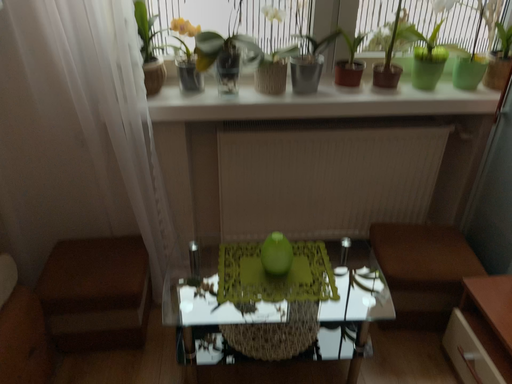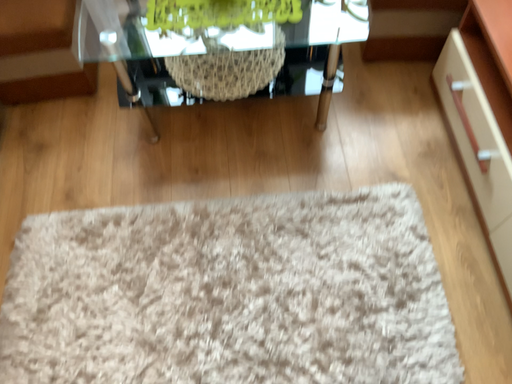
Question: Which way did the camera rotate in the video?

Choices:
 (A) rotated upward
 (B) rotated downward

Answer: (B)